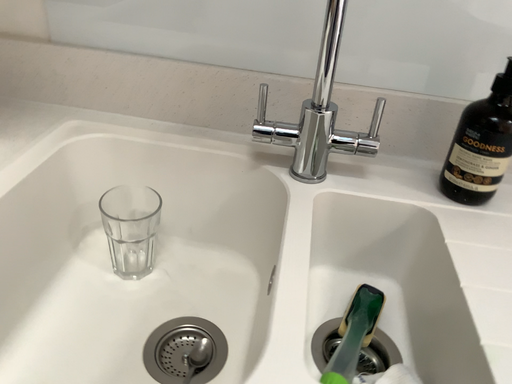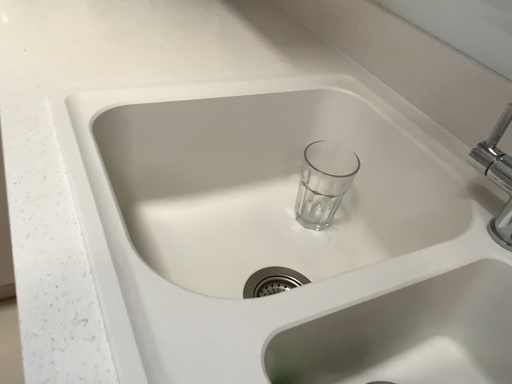
Question: Which way did the camera rotate in the video?

Choices:
 (A) rotated downward
 (B) rotated upward

Answer: (B)